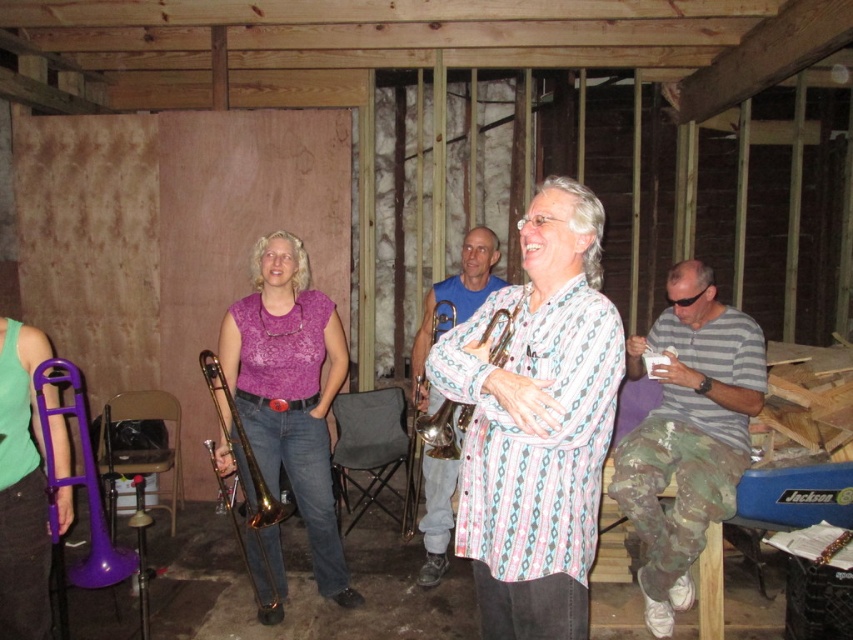
Who is positioned more to the left, lace fabric blouse at center or gold shiny trumpet at center?

lace fabric blouse at center is more to the left.

Find the location of a particular element. The width and height of the screenshot is (853, 640). lace fabric blouse at center is located at coordinates (289, 392).

Where is `lace fabric blouse at center`? The width and height of the screenshot is (853, 640). lace fabric blouse at center is located at coordinates (289, 392).

Does lace fabric blouse at center have a lesser height compared to pink striped shirt at center?

Incorrect, lace fabric blouse at center's height does not fall short of pink striped shirt at center's.

Does lace fabric blouse at center have a larger size compared to pink striped shirt at center?

Yes.

Who is more forward, (268, 604) or (426, 540)?

Point (268, 604)

Find the location of `lace fabric blouse at center`. lace fabric blouse at center is located at coordinates (289, 392).

Between pink patterned shirt at center and gray striped shirt at right, which one is positioned higher?

pink patterned shirt at center

Does pink patterned shirt at center appear on the left side of gray striped shirt at right?

Yes, pink patterned shirt at center is to the left of gray striped shirt at right.

Does point (576, 540) come farther from viewer compared to point (682, 509)?

That is False.

You are a GUI agent. You are given a task and a screenshot of the screen. Output one action in this format:
    pyautogui.click(x=<x>, y=<y>)
    Task: Click on the pink patterned shirt at center
    The image size is (853, 640).
    Given the screenshot: What is the action you would take?
    pyautogui.click(x=537, y=422)